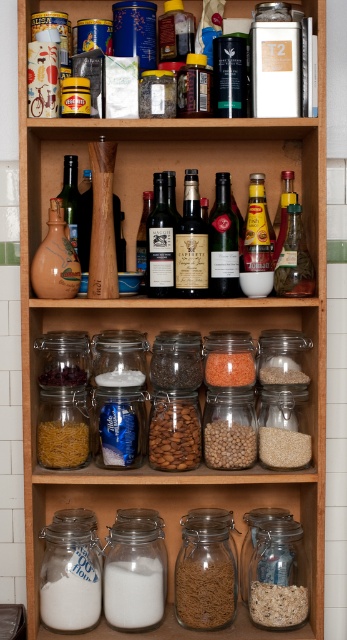
Question: Which object appears closest to the camera in this image?

Choices:
 (A) white matte cereal at lower center
 (B) golden matte pasta at center
 (C) green glass bottle at center
 (D) clear glass jar at lower right

Answer: (D)

Question: Can you confirm if clear glass jar at lower right is thinner than golden matte pasta at center?

Choices:
 (A) yes
 (B) no

Answer: (B)

Question: Does white matte glass jar at lower center have a larger size compared to clear glass jar at lower right?

Choices:
 (A) yes
 (B) no

Answer: (A)

Question: Which point is closer to the camera?

Choices:
 (A) pyautogui.click(x=285, y=193)
 (B) pyautogui.click(x=63, y=440)
 (C) pyautogui.click(x=260, y=541)

Answer: (B)

Question: Which point is closer to the camera?

Choices:
 (A) (53, 576)
 (B) (192, 192)
 (C) (294, 465)

Answer: (A)

Question: Is clear glass jar at lower right above yellow glass bottle at center?

Choices:
 (A) yes
 (B) no

Answer: (B)